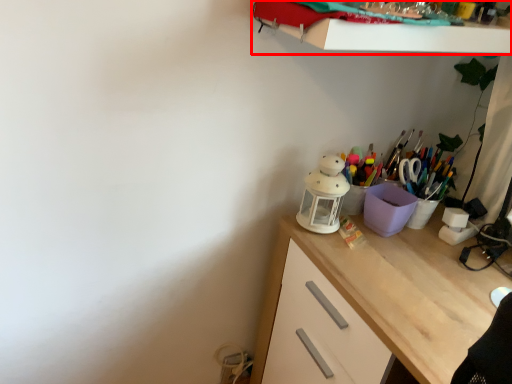
Question: From the image's perspective, where is shelf (annotated by the red box) located in relation to desk in the image?

Choices:
 (A) below
 (B) above

Answer: (B)